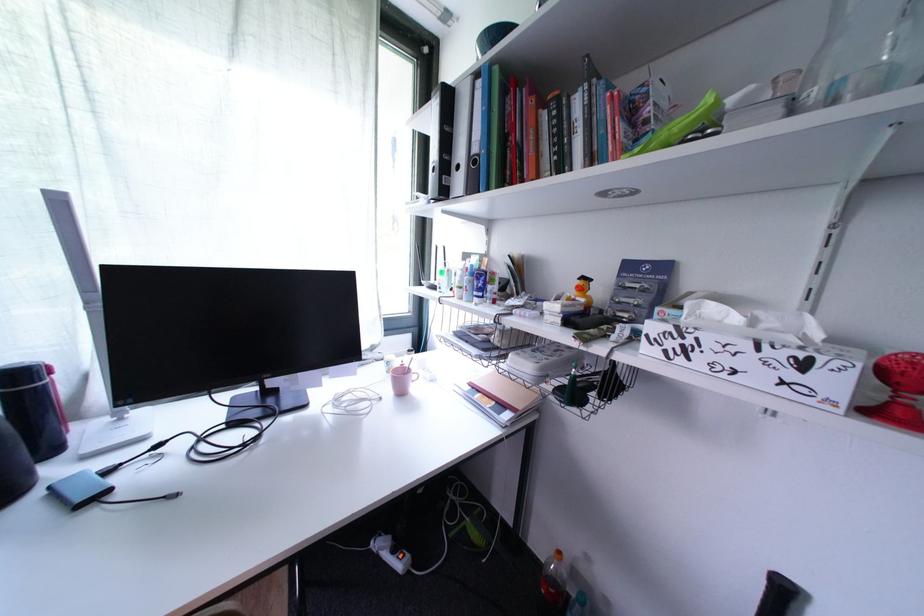
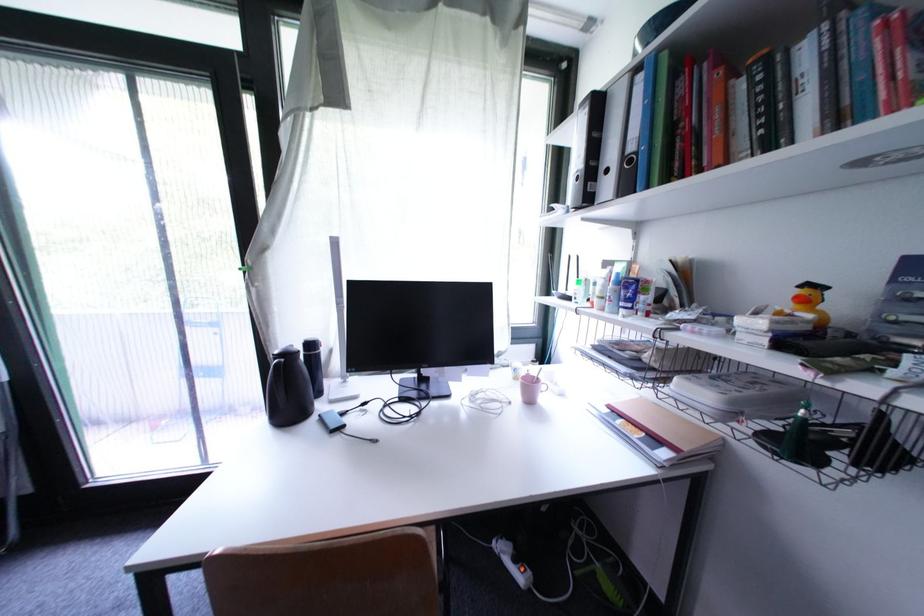
The images are taken continuously from a first-person perspective. In which direction are you moving?

The cameraman walked toward left, backward.